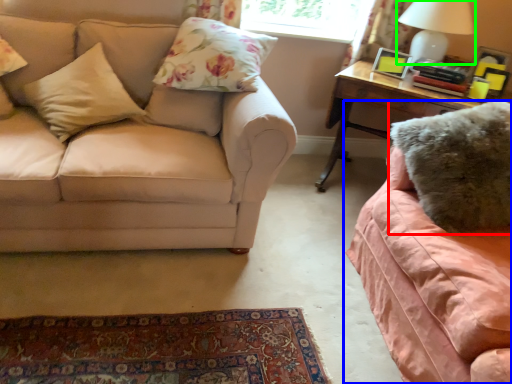
Question: Which object is positioned closest to pillow (highlighted by a red box)? Select from studio couch (highlighted by a blue box) and table lamp (highlighted by a green box).

Choices:
 (A) studio couch
 (B) table lamp

Answer: (A)